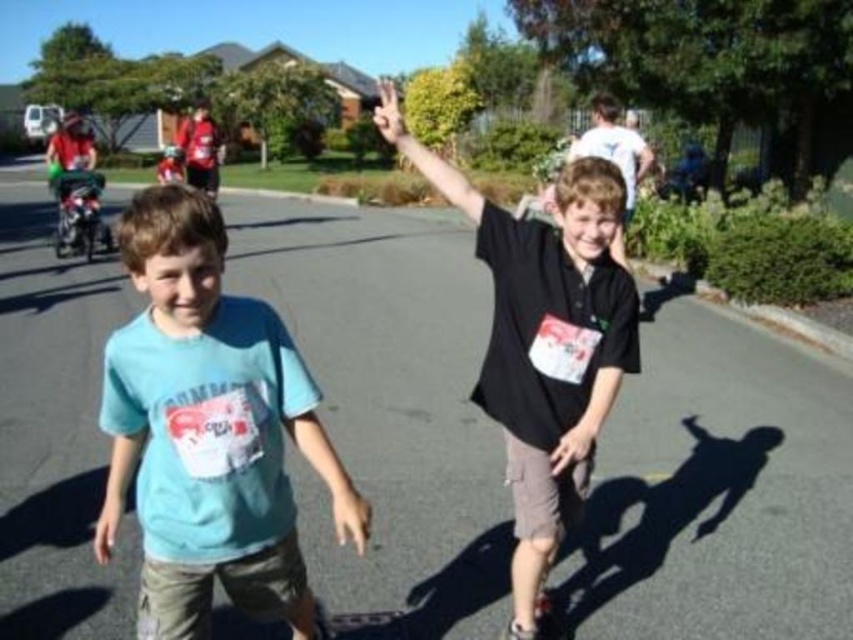
Can you confirm if light blue cotton shirt at center is positioned to the right of matte black hand at center?

No, light blue cotton shirt at center is not to the right of matte black hand at center.

Between light blue cotton shirt at center and matte black hand at center, which one has more height?

Standing taller between the two is light blue cotton shirt at center.

Between point (149, 442) and point (579, 432), which one is positioned in front?

Point (149, 442) is more forward.

The image size is (853, 640). Identify the location of light blue cotton shirt at center. (207, 429).

The height and width of the screenshot is (640, 853). I want to click on black matte shirt at center, so click(x=547, y=346).

From the picture: Is black matte shirt at center positioned before white matte hand at center?

Yes, it is in front of white matte hand at center.

Which is behind, point (503, 340) or point (376, 118)?

The point (376, 118) is more distant.

This screenshot has width=853, height=640. Identify the location of black matte shirt at center. (547, 346).

Between point (173, 276) and point (554, 310), which one is positioned in front?

Point (173, 276)

Is light blue cotton shirt at center smaller than black matte shirt at center?

Yes.

Is point (181, 630) positioned behind point (585, 406)?

No, (181, 630) is closer to viewer.

Where is `light blue cotton shirt at center`? Image resolution: width=853 pixels, height=640 pixels. light blue cotton shirt at center is located at coordinates 207,429.